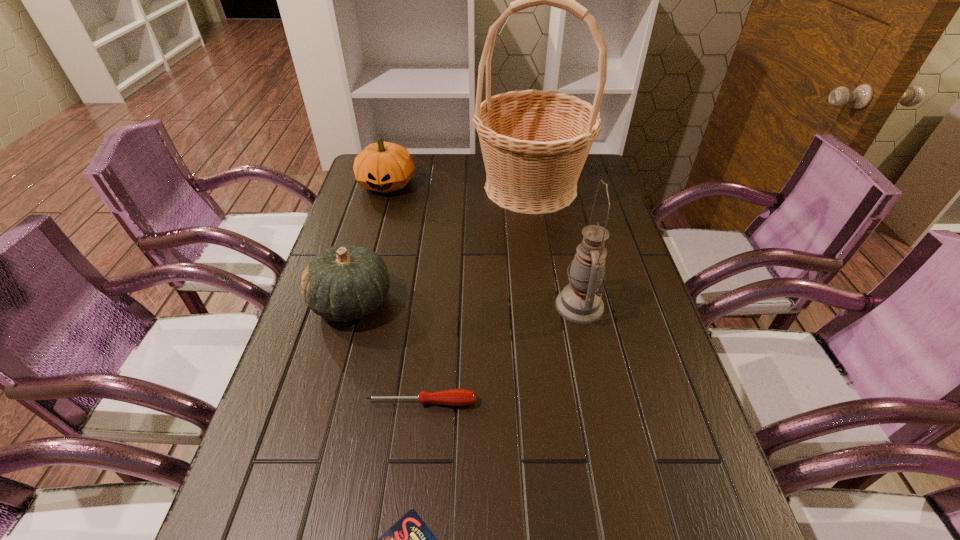
The height and width of the screenshot is (540, 960). In order to click on object that can be found as the closest to the basket in this screenshot , I will do `click(384, 167)`.

Identify which object is the fifth closest to the second tallest object. Please provide its 2D coordinates. Your answer should be formatted as a tuple, i.e. [(x, y)], where the tuple contains the x and y coordinates of a point satisfying the conditions above.

[(384, 167)]

This screenshot has width=960, height=540. In order to click on free space that satisfies the following two spatial constraints: 1. on the back side of the screwdriver; 2. on the left side of the fifth shortest object in this screenshot , I will do `click(432, 306)`.

The height and width of the screenshot is (540, 960). I want to click on free location that satisfies the following two spatial constraints: 1. on the side of the basket with the carved face; 2. on the left side of the farther gourd, so click(386, 187).

You are a GUI agent. You are given a task and a screenshot of the screen. Output one action in this format:
    pyautogui.click(x=<x>, y=<y>)
    Task: Click on the vacant space that satisfies the following two spatial constraints: 1. on the side of the fifth shortest object with the carved face; 2. on the right side of the farther gourd
    This screenshot has height=540, width=960.
    Given the screenshot: What is the action you would take?
    pyautogui.click(x=353, y=306)

What are the coordinates of `vacant space that satisfies the following two spatial constraints: 1. on the side of the second tallest object with the carved face; 2. on the right side of the farther gourd` in the screenshot? It's located at (353, 306).

Locate an element on the screen. This screenshot has width=960, height=540. free space in the image that satisfies the following two spatial constraints: 1. on the side of the farther gourd with the carved face; 2. on the left side of the tallest object is located at coordinates (386, 187).

Find the location of a particular element. This screenshot has height=540, width=960. vacant space that satisfies the following two spatial constraints: 1. on the side of the farther gourd with the carved face; 2. on the left side of the oil lamp is located at coordinates (353, 306).

At what (x,y) coordinates should I click in order to perform the action: click on blank area in the image that satisfies the following two spatial constraints: 1. on the side of the screwdriver with the carved face; 2. on the right side of the farther gourd. Please return your answer as a coordinate pair (x, y). This screenshot has height=540, width=960. Looking at the image, I should click on (326, 402).